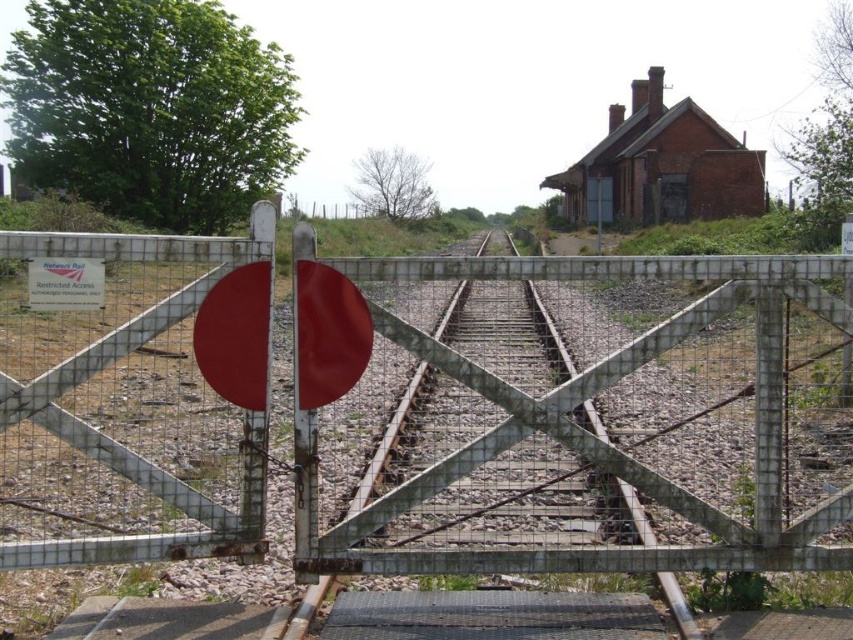
Who is positioned more to the right, metal mesh gate at center or smooth metal train track at center?

smooth metal train track at center is more to the right.

I want to click on metal mesh gate at center, so click(x=422, y=408).

This screenshot has width=853, height=640. Identify the location of metal mesh gate at center. (422, 408).